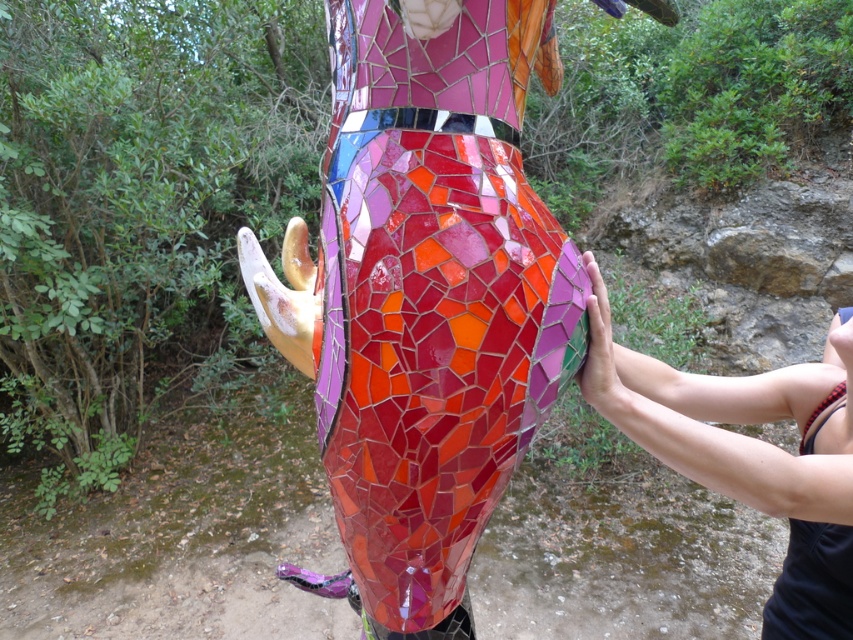
Measure the distance between mosaic glass sculpture at center and camera.

73.78 centimeters

Image resolution: width=853 pixels, height=640 pixels. In order to click on mosaic glass sculpture at center in this screenshot , I will do coord(426,292).

Find the location of `mosaic glass sculpture at center`. mosaic glass sculpture at center is located at coordinates (426, 292).